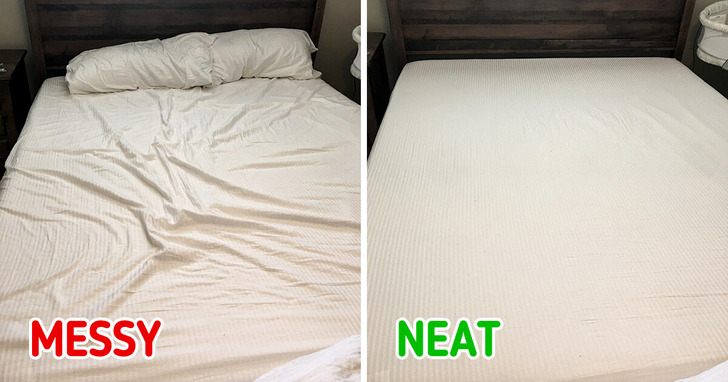
This screenshot has width=728, height=382. I want to click on bed, so click(223, 208), click(518, 230).